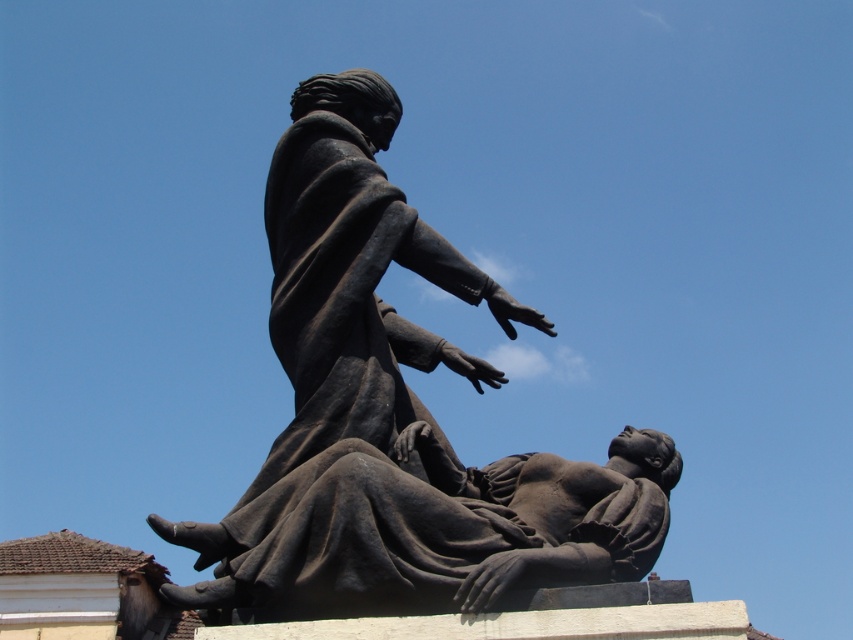
Question: Does bronze statue at center appear over matte black statue at center?

Choices:
 (A) no
 (B) yes

Answer: (B)

Question: Which of the following is the farthest from the observer?

Choices:
 (A) bronze statue at center
 (B) matte black statue at center

Answer: (A)

Question: Is bronze statue at center bigger than matte black statue at center?

Choices:
 (A) no
 (B) yes

Answer: (B)

Question: Is bronze statue at center further to camera compared to matte black statue at center?

Choices:
 (A) yes
 (B) no

Answer: (A)